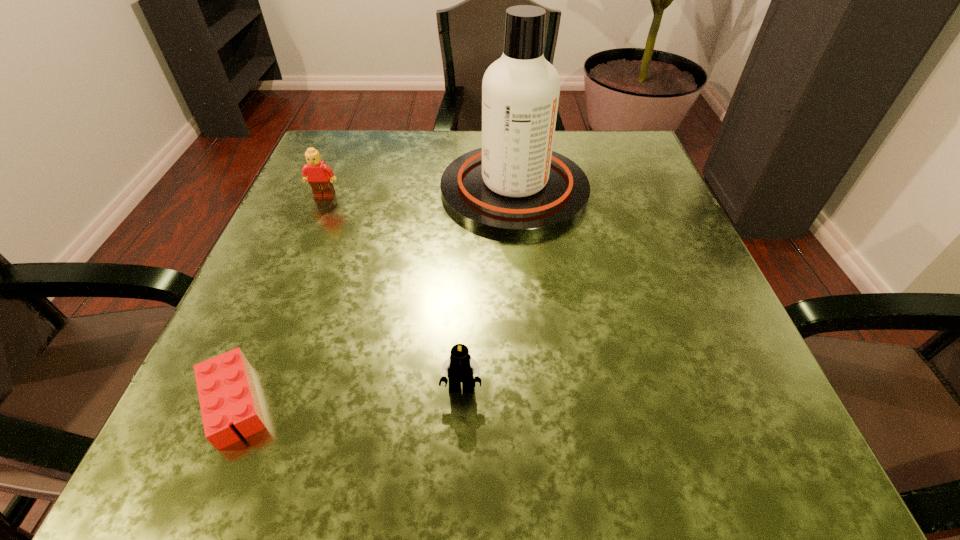
Where is `free space at the far right corner of the desktop`? free space at the far right corner of the desktop is located at coordinates (624, 135).

In the image, there is a desktop. What are the coordinates of `free space at the near right corner` in the screenshot? It's located at (681, 482).

The width and height of the screenshot is (960, 540). I want to click on free space that is in between the shortest object and the third shortest object, so click(279, 300).

The image size is (960, 540). Identify the location of free space between the tallest object and the shortest object. (374, 296).

You are a GUI agent. You are given a task and a screenshot of the screen. Output one action in this format:
    pyautogui.click(x=<x>, y=<y>)
    Task: Click on the vacant region between the rightmost Lego and the shortest Lego
    This screenshot has height=540, width=960.
    Given the screenshot: What is the action you would take?
    pyautogui.click(x=348, y=396)

At what (x,y) coordinates should I click in order to perform the action: click on unoccupied position between the tallest Lego and the shortest object. Please return your answer as a coordinate pair (x, y). Looking at the image, I should click on (279, 300).

Locate an element on the screen. unoccupied area between the shortest object and the second shortest Lego is located at coordinates tap(348, 396).

Locate an element on the screen. The height and width of the screenshot is (540, 960). free space between the shortest object and the second shortest object is located at coordinates click(348, 396).

The image size is (960, 540). I want to click on unoccupied position between the farthest Lego and the shortest object, so click(279, 300).

Locate an element on the screen. Image resolution: width=960 pixels, height=540 pixels. free space between the shortest Lego and the third shortest object is located at coordinates (279, 300).